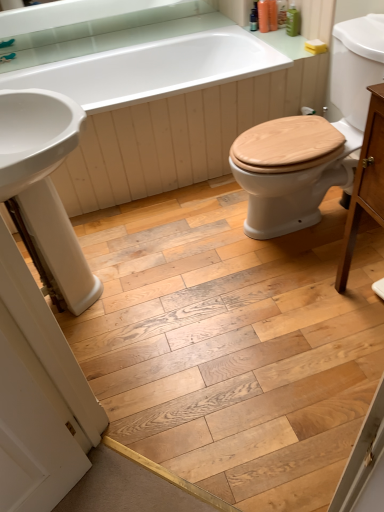
Find the location of a particular element. The width and height of the screenshot is (384, 512). vacant space in between light brown wood cabinet at right and white glossy sink at left is located at coordinates (227, 304).